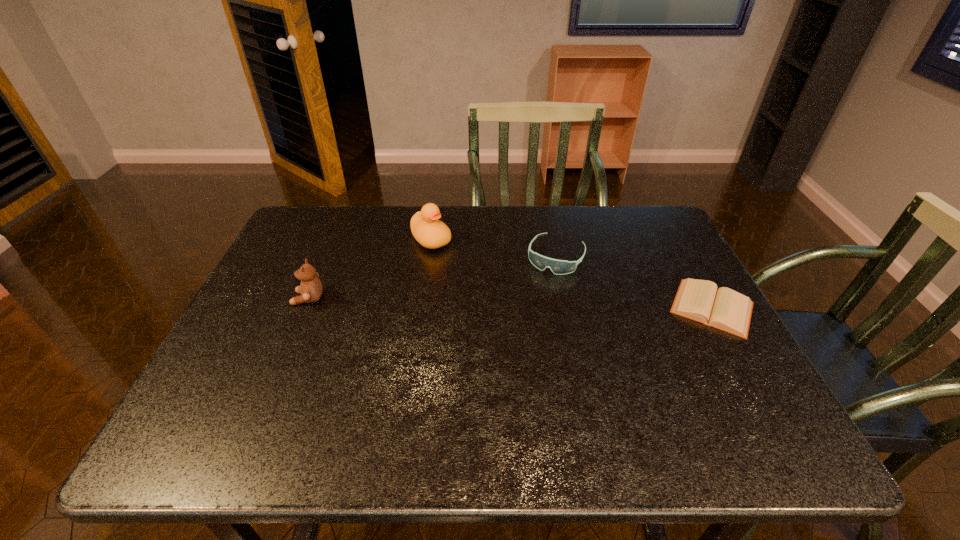
This screenshot has height=540, width=960. In the image, there is a desktop. Find the location of `vacant region at the far edge`. vacant region at the far edge is located at coordinates (586, 220).

Where is `vacant area at the near edge of the desktop`? The width and height of the screenshot is (960, 540). vacant area at the near edge of the desktop is located at coordinates (555, 398).

Find the location of a particular element. vacant region at the left edge of the desktop is located at coordinates (259, 289).

Identify the location of free space at the right edge of the desktop. (667, 265).

Where is `vacant space at the far left corner of the desktop`? Image resolution: width=960 pixels, height=540 pixels. vacant space at the far left corner of the desktop is located at coordinates (296, 247).

The height and width of the screenshot is (540, 960). In the image, there is a desktop. What are the coordinates of `blank space at the near right corner` in the screenshot? It's located at (703, 376).

This screenshot has width=960, height=540. Identify the location of vacant region between the diary and the duck. (571, 273).

Locate an element on the screen. The image size is (960, 540). free space between the rightmost object and the teddy bear is located at coordinates 510,303.

Identify the location of vacant area that lies between the goggles and the duck. (493, 248).

Find the location of `vacant area that lies between the shortest object and the duck`. vacant area that lies between the shortest object and the duck is located at coordinates (571, 273).